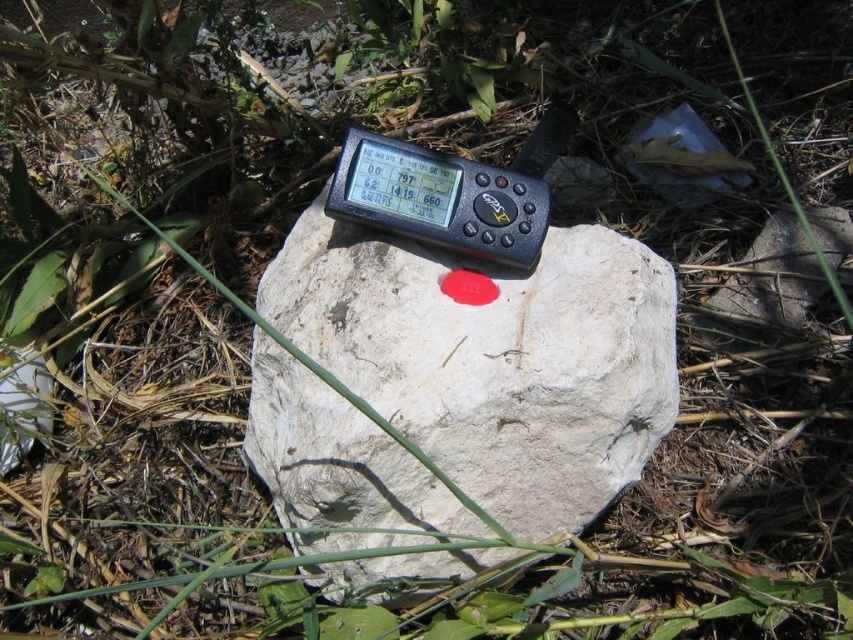
Is white rough rock at center positioned in front of black plastic thermometer at center?

Yes, it is in front of black plastic thermometer at center.

Does white rough rock at center appear on the left side of black plastic thermometer at center?

In fact, white rough rock at center is to the right of black plastic thermometer at center.

Does point (254, 451) come in front of point (347, 189)?

No.

Find the location of a particular element. white rough rock at center is located at coordinates (494, 358).